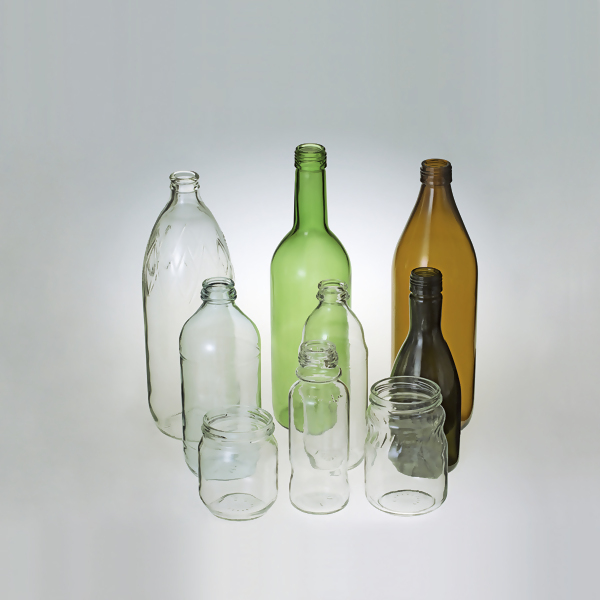
At what (x,y) coordinates should I click in order to perform the action: click on clear glass containers. Please return your answer as a coordinate pair (x, y). This screenshot has height=600, width=600. Looking at the image, I should click on (229, 357), (182, 265), (233, 464), (348, 333), (325, 417), (415, 454).